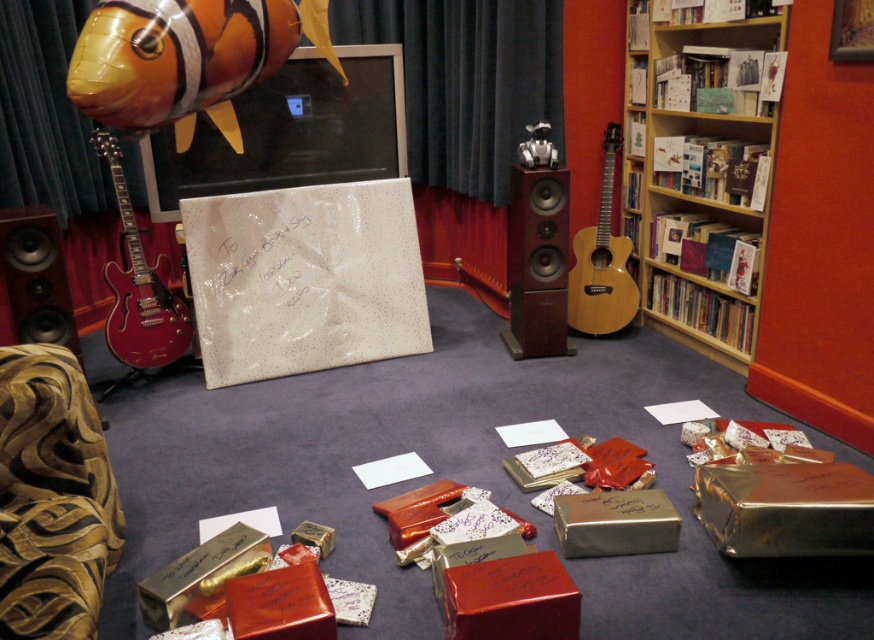
Between point (200, 250) and point (532, 134), which one is positioned behind?

Positioned behind is point (532, 134).

Who is positioned more to the right, glossy white board at center or metallic silver robot at center?

From the viewer's perspective, metallic silver robot at center appears more on the right side.

Does point (251, 214) come in front of point (529, 140)?

That is True.

I want to click on glossy white board at center, so click(x=304, y=278).

Does wooden/matte speaker at center appear over shiny gold box at center?

Yes, wooden/matte speaker at center is above shiny gold box at center.

Is point (531, 209) positioned in front of point (225, 602)?

That is False.

Where is `wooden/matte speaker at center`? This screenshot has height=640, width=874. wooden/matte speaker at center is located at coordinates (538, 262).

Is metallic gold gift box at center to the right of metallic gold box at center from the viewer's perspective?

No, metallic gold gift box at center is not to the right of metallic gold box at center.

Identify the location of metallic gold gift box at center. (511, 600).